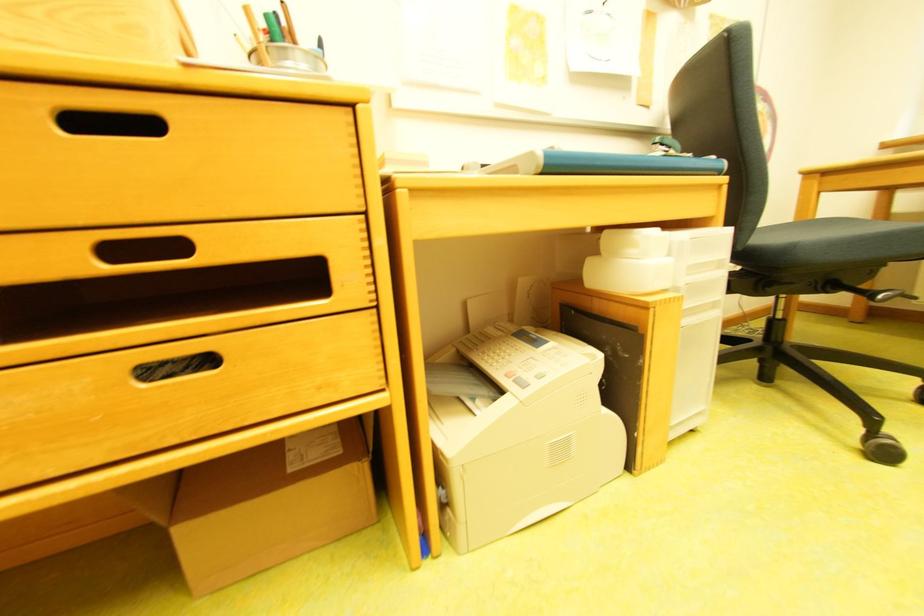
Where would you sit the chair sitting surface? Please return your answer as a coordinate pair (x, y).

(874, 238)